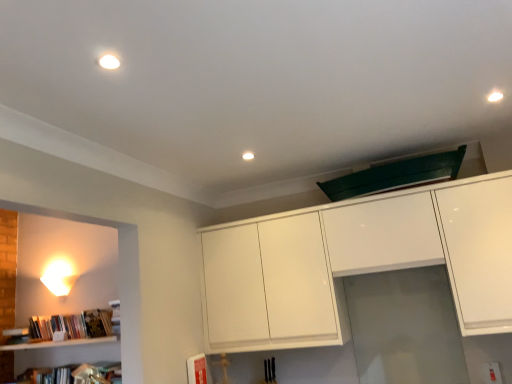
Question: In terms of width, does white glossy cabinet at upper center look wider or thinner when compared to white glossy wall sconce at left?

Choices:
 (A) wide
 (B) thin

Answer: (A)

Question: From a real-world perspective, is white glossy cabinet at upper center physically located above or below white glossy wall sconce at left?

Choices:
 (A) below
 (B) above

Answer: (A)

Question: Based on their relative distances, which object is nearer to the white glossy wall sconce at left?

Choices:
 (A) transparent glass door at center
 (B) white glossy cabinet at upper center

Answer: (B)

Question: Which object is the farthest from the white glossy cabinet at upper center?

Choices:
 (A) transparent glass door at center
 (B) white glossy wall sconce at left

Answer: (B)